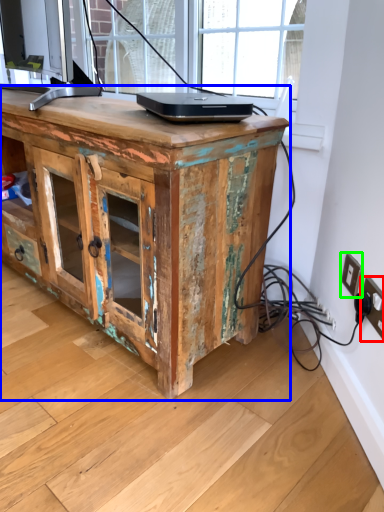
Question: Considering the real-world distances, which object is farthest from electric outlet (highlighted by a red box)? desk (highlighted by a blue box) or electric outlet (highlighted by a green box)?

Choices:
 (A) desk
 (B) electric outlet

Answer: (A)